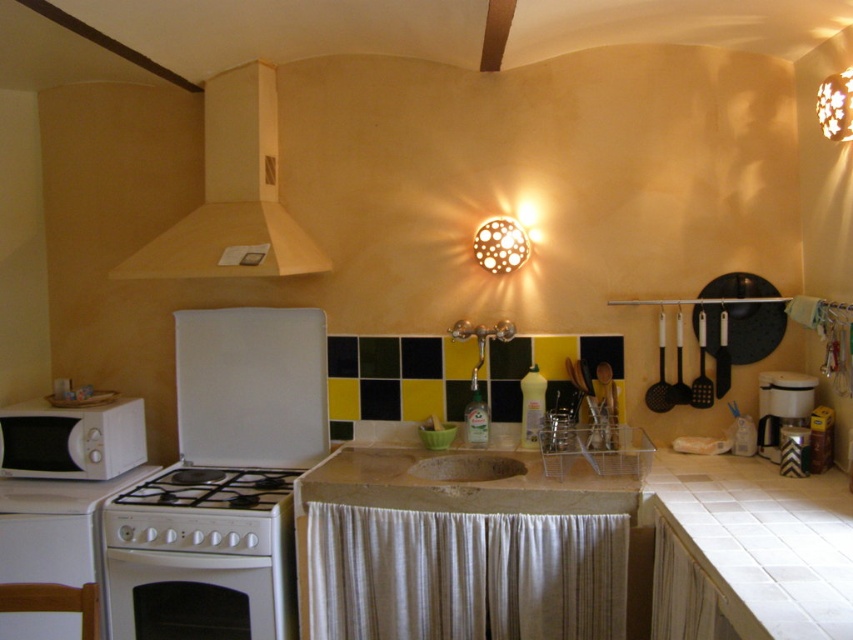
You are a chef preparing to place a large pot on the white tile countertop at lower right and the brown stone sink at center. Which surface is lower in position?

The white tile countertop at lower right is located below the brown stone sink at center, so it is lower in position.

What is the 2D coordinate of the white tile countertop at lower right?

The white tile countertop at lower right is located at the 2D coordinate point of (763, 541).

In the scene shown: You are a kitchen designer planning to place a new appliance between the white matte microwave at left and the white glossy gas stove at lower left. The new appliance requires a minimum of 50 cm of space. Can you determine if there is enough space between them based on their widths?

The white matte microwave at left is narrower than the white glossy gas stove at lower left, but since the exact widths are not provided, it is impossible to determine if there is enough space for the new appliance requiring 50 cm.